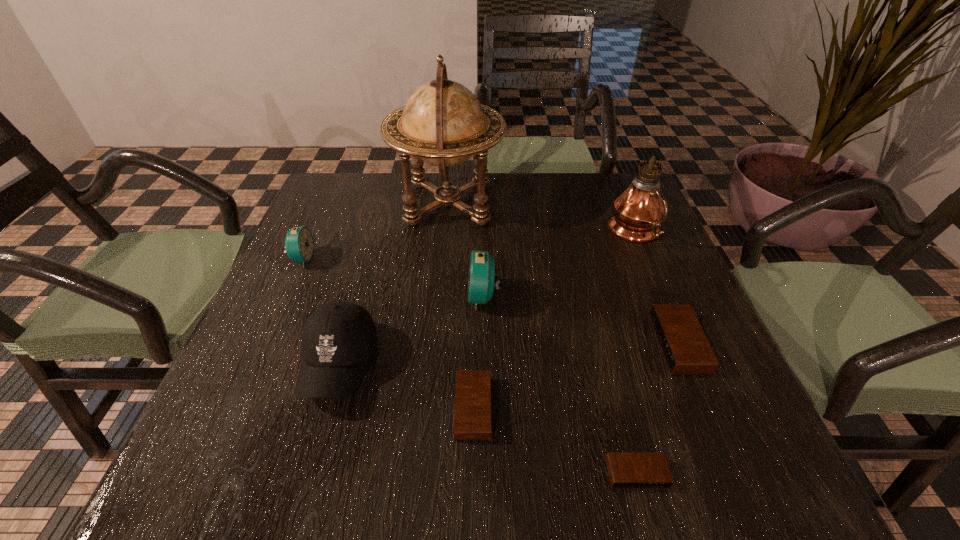
Identify the location of vacant space located on the front face of the third tallest alarm clock. The image size is (960, 540). (612, 344).

This screenshot has width=960, height=540. Find the location of `vacant space located 0.330m on the front face of the third tallest alarm clock`. vacant space located 0.330m on the front face of the third tallest alarm clock is located at coordinates (490, 344).

Locate an element on the screen. vacant region located 0.150m on the front face of the third tallest alarm clock is located at coordinates (582, 344).

The width and height of the screenshot is (960, 540). I want to click on free region located on the front face of the leftmost black alarm clock, so click(x=525, y=408).

Image resolution: width=960 pixels, height=540 pixels. What are the coordinates of `globe at the far edge` in the screenshot? It's located at (442, 123).

Where is `oil lamp that is at the far edge`? oil lamp that is at the far edge is located at coordinates (638, 212).

You are a GUI agent. You are given a task and a screenshot of the screen. Output one action in this format:
    pyautogui.click(x=<x>, y=<y>)
    Task: Click on the baseball cap that is at the left edge
    The height and width of the screenshot is (540, 960).
    Given the screenshot: What is the action you would take?
    pyautogui.click(x=338, y=338)

Image resolution: width=960 pixels, height=540 pixels. Identify the location of alarm clock at the left edge. (299, 244).

Find the location of a particular element. Image resolution: width=960 pixels, height=540 pixels. oil lamp that is positioned at the right edge is located at coordinates (638, 212).

Locate an element on the screen. The image size is (960, 540). alarm clock located in the right edge section of the desktop is located at coordinates (686, 350).